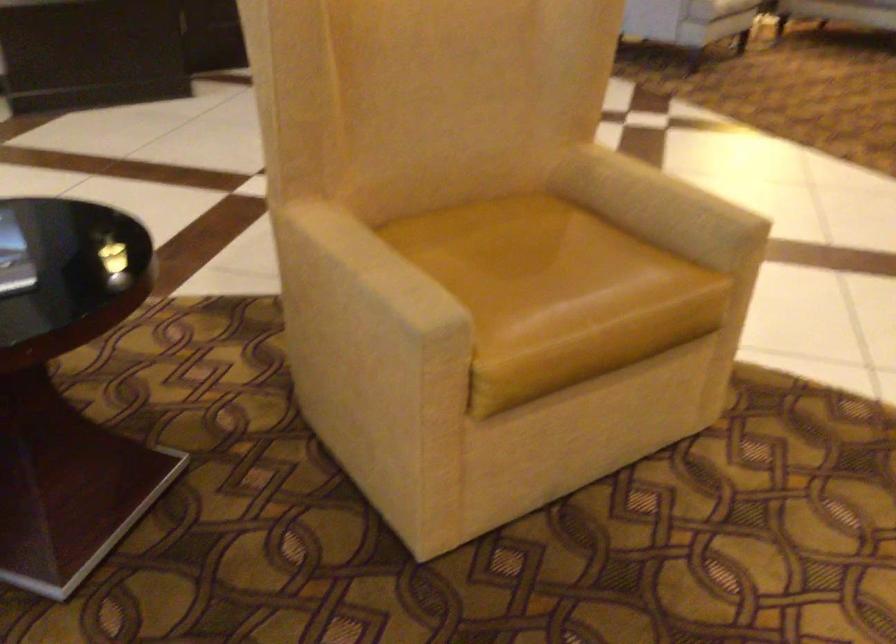
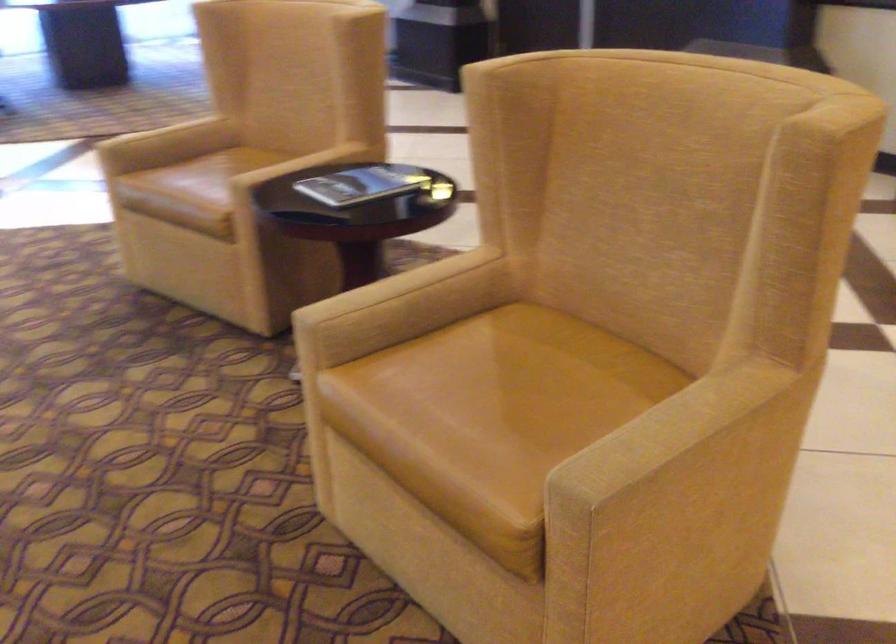
The point at (352, 269) is marked in the first image. Where is the corresponding point in the second image?

(394, 286)